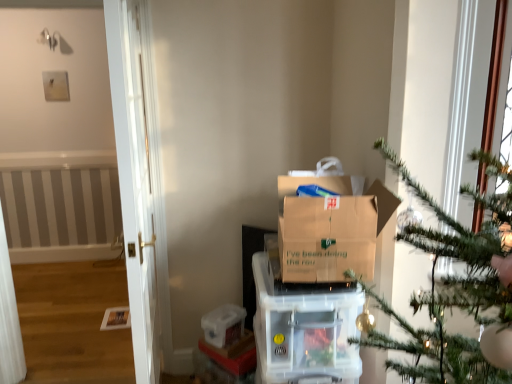
Question: Is brown cardboard box at center in front of or behind clear plastic storage container at center in the image?

Choices:
 (A) behind
 (B) front

Answer: (B)

Question: From the image's perspective, is brown cardboard box at center positioned above or below clear plastic storage container at center?

Choices:
 (A) above
 (B) below

Answer: (A)

Question: Which object is the farthest from the brown cardboard box at center?

Choices:
 (A) transparent plastic container at lower center
 (B) clear plastic storage container at center

Answer: (A)

Question: Which is farther from the transparent plastic container at lower center?

Choices:
 (A) brown cardboard box at center
 (B) clear plastic storage container at center

Answer: (A)